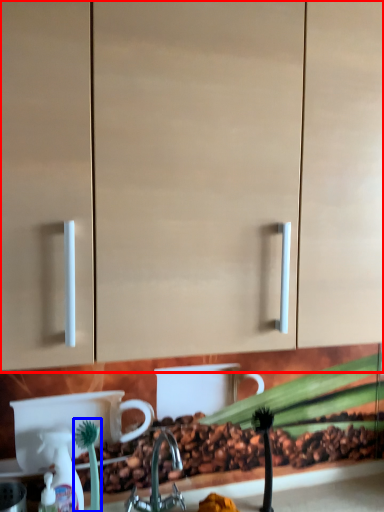
Question: Which object appears closest to the camera in this image, cabinetry (highlighted by a red box) or plant (highlighted by a blue box)?

Choices:
 (A) cabinetry
 (B) plant

Answer: (A)